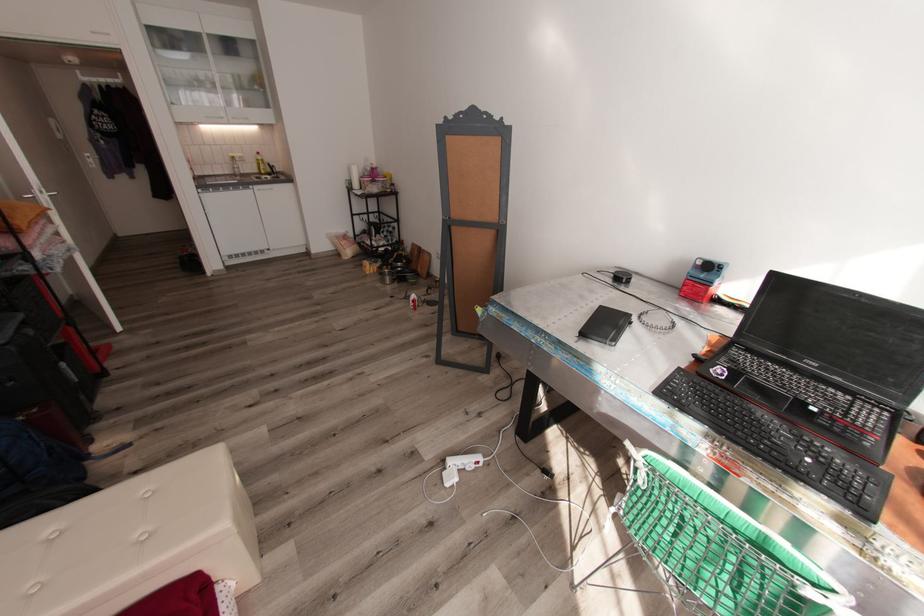
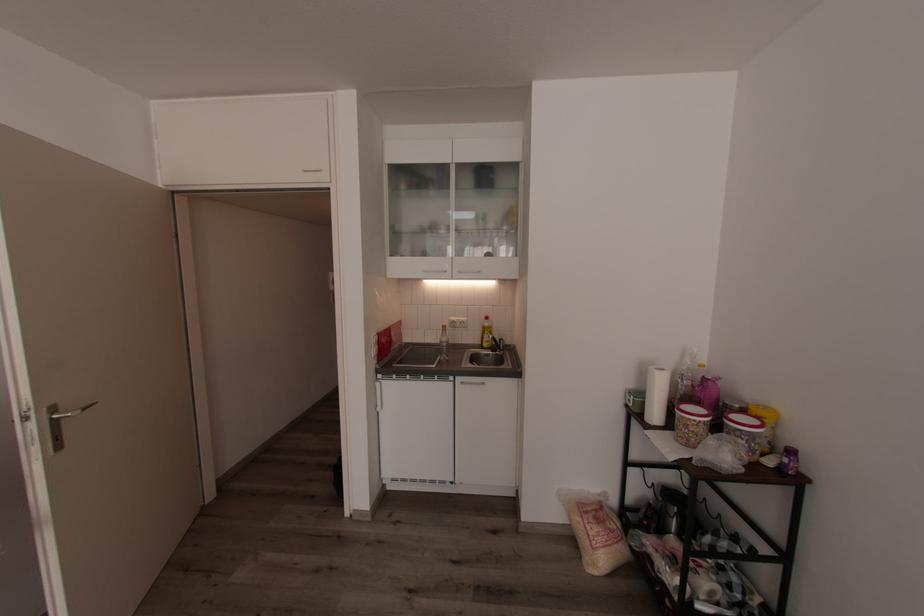
Where in the second image is the point corresponding to the point at 369,183 from the first image?

(690, 426)